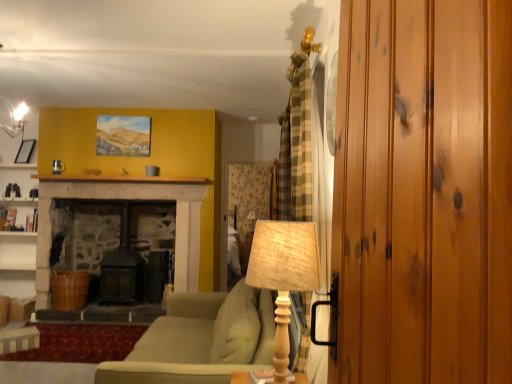
Question: From a real-world perspective, is matte stone fireplace at upper center on top of wooden textured table lamp at center, the 2th table lamp viewed from the back?

Choices:
 (A) no
 (B) yes

Answer: (B)

Question: From the image's perspective, is matte stone fireplace at upper center over wooden textured table lamp at center, the 2th table lamp viewed from the back?

Choices:
 (A) no
 (B) yes

Answer: (B)

Question: Would you say wooden textured table lamp at center, the 2th table lamp viewed from the back, is part of matte stone fireplace at upper center's contents?

Choices:
 (A) no
 (B) yes

Answer: (A)

Question: From the image's perspective, would you say matte stone fireplace at upper center is shown under wooden textured table lamp at center, the first table lamp when ordered from front to back?

Choices:
 (A) yes
 (B) no

Answer: (B)

Question: Is there a large distance between matte stone fireplace at upper center and wooden textured table lamp at center, the first table lamp when ordered from front to back?

Choices:
 (A) yes
 (B) no

Answer: (A)

Question: Is wooden textured table lamp at center, the 2th table lamp viewed from the back, situated inside matte stone fireplace at upper center or outside?

Choices:
 (A) outside
 (B) inside

Answer: (A)

Question: Considering the positions of point (275, 365) and point (56, 175), is point (275, 365) closer or farther from the camera than point (56, 175)?

Choices:
 (A) closer
 (B) farther

Answer: (A)

Question: Considering the positions of wooden textured table lamp at center, the first table lamp when ordered from front to back, and matte stone fireplace at upper center in the image, is wooden textured table lamp at center, the first table lamp when ordered from front to back, bigger or smaller than matte stone fireplace at upper center?

Choices:
 (A) big
 (B) small

Answer: (A)

Question: Considering the positions of wooden textured table lamp at center, the 2th table lamp viewed from the back, and matte stone fireplace at upper center in the image, is wooden textured table lamp at center, the 2th table lamp viewed from the back, wider or thinner than matte stone fireplace at upper center?

Choices:
 (A) thin
 (B) wide

Answer: (B)

Question: Based on their sizes in the image, would you say burlap lampshade at center, placed as the second table lamp when sorted from front to back, is bigger or smaller than wooden textured table lamp at center, the 2th table lamp viewed from the back?

Choices:
 (A) big
 (B) small

Answer: (B)

Question: From their relative heights in the image, would you say burlap lampshade at center, placed as the second table lamp when sorted from front to back, is taller or shorter than wooden textured table lamp at center, the 2th table lamp viewed from the back?

Choices:
 (A) tall
 (B) short

Answer: (B)

Question: From a real-world perspective, relative to wooden textured table lamp at center, the 2th table lamp viewed from the back, is burlap lampshade at center, placed as the second table lamp when sorted from front to back, vertically above or below?

Choices:
 (A) below
 (B) above

Answer: (A)

Question: In terms of width, does burlap lampshade at center, placed as the second table lamp when sorted from front to back, look wider or thinner when compared to wooden textured table lamp at center, the 2th table lamp viewed from the back?

Choices:
 (A) wide
 (B) thin

Answer: (B)

Question: From the image's perspective, is matte black picture frame at upper left above or below matte stone fireplace at upper center?

Choices:
 (A) above
 (B) below

Answer: (A)

Question: Considering the positions of point (23, 142) and point (72, 178), is point (23, 142) closer or farther from the camera than point (72, 178)?

Choices:
 (A) farther
 (B) closer

Answer: (A)